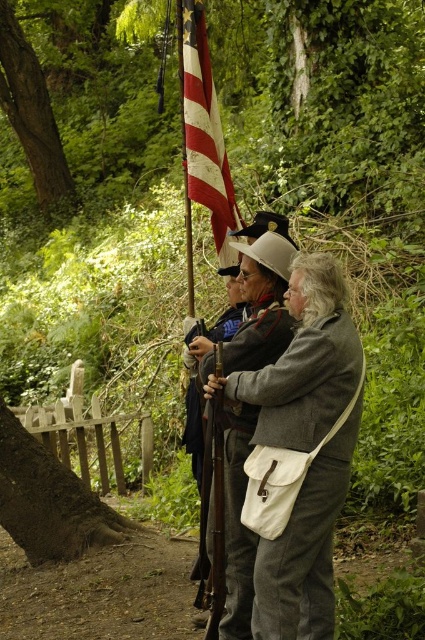
You are a photographer at the reenactment event. You want to capture a photo where both the american flag at center and the shiny brown leather sword at center are clearly visible. Based on their positions, which object should you ensure is in the foreground to avoid blocking the other?

The american flag at center is positioned over the shiny brown leather sword at center, so to avoid blocking the sword, the flag should be in the foreground.